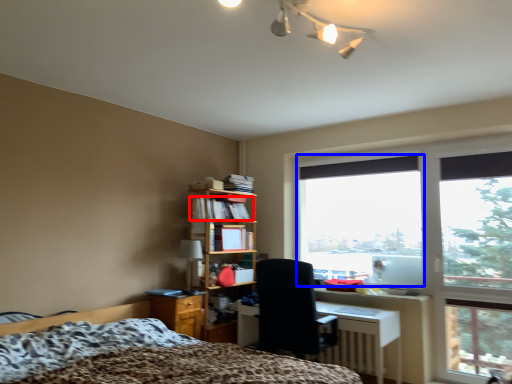
Question: Which of the following is the closest to the observer, book (highlighted by a red box) or window screen (highlighted by a blue box)?

Choices:
 (A) book
 (B) window screen

Answer: (B)